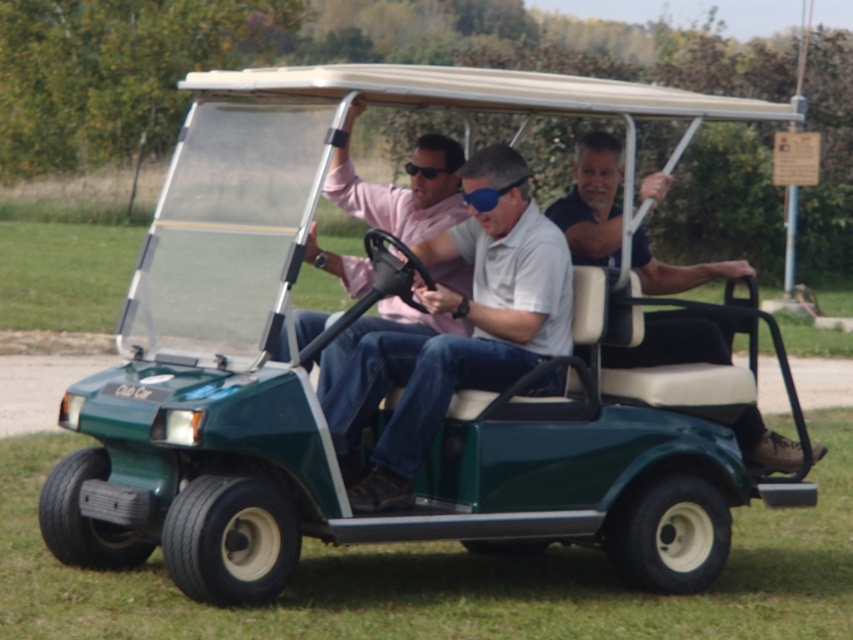
You are standing in front of the golf cart and want to place a small flag at the point that is closer to you. Which point should you choose between point (494, 280) and point (428, 170)?

Point (494, 280) is closer to the viewer than point (428, 170), so you should place the flag at point (494, 280).

You are a safety inspector checking the golf cart for proper equipment placement. The blue denim jeans at center and blue matte goggles at center are both located at the center of the cart. According to safety regulations, the goggles must be within 5 feet of the jeans for easy access. Is the current placement compliant?

The blue denim jeans at center is 7.15 feet from blue matte goggles at center. Since 7.15 feet exceeds the 5 feet requirement, the goggles are not within the required distance from the jeans, making the placement noncompliant.

You are a photographer trying to capture a clear shot of the light blue cotton shirt at center and the blue matte goggles at center. Which object should you focus on first if you want to ensure both are in focus?

The light blue cotton shirt at center is in front of the blue matte goggles at center, so you should focus on the light blue cotton shirt at center first to ensure both are in focus.